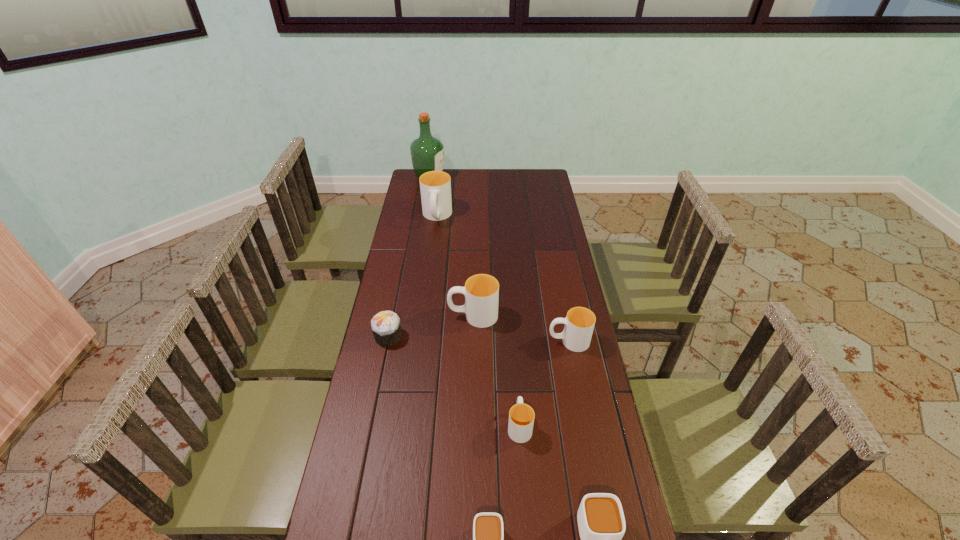
Where is `the nearest yellow cup`? The height and width of the screenshot is (540, 960). the nearest yellow cup is located at coordinates (521, 416).

The image size is (960, 540). I want to click on vacant space positioned on the front-facing side of the green liquor, so click(x=514, y=178).

In order to click on vacant area situated with the handle on the side of the second tallest object in this screenshot , I will do click(x=429, y=280).

At what (x,y) coordinates should I click in order to perform the action: click on vacant space located with the handle on the side of the fifth shortest cup. Please return your answer as a coordinate pair (x, y). Looking at the image, I should click on (418, 315).

Find the location of a particular element. This screenshot has height=540, width=960. vacant region located 0.260m with the handle on the side of the fifth shortest cup is located at coordinates (376, 315).

This screenshot has width=960, height=540. In order to click on free space located 0.160m with the handle on the side of the fifth shortest cup in this screenshot , I will do `click(404, 315)`.

This screenshot has height=540, width=960. Identify the location of free space located with the handle on the side of the fourth nearest cup. (495, 341).

You are a GUI agent. You are given a task and a screenshot of the screen. Output one action in this format:
    pyautogui.click(x=<x>, y=<y>)
    Task: Click on the vacant space located with the handle on the side of the fourth nearest cup
    This screenshot has width=960, height=540.
    Given the screenshot: What is the action you would take?
    pyautogui.click(x=434, y=341)

Locate an element on the screen. vacant space located with the handle on the side of the fourth nearest cup is located at coordinates (510, 341).

Locate an element on the screen. vacant point located on the front of the cupcake is located at coordinates (366, 446).